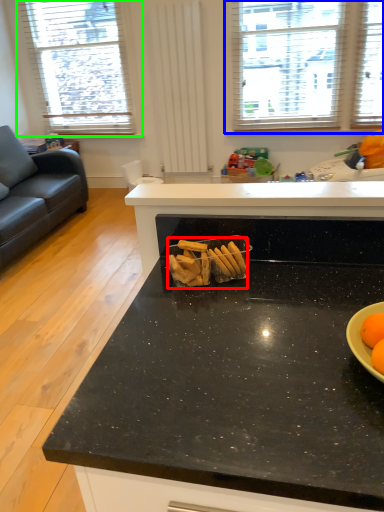
Question: Which is nearer to the snack (highlighted by a red box)? window (highlighted by a blue box) or window (highlighted by a green box).

Choices:
 (A) window
 (B) window

Answer: (A)